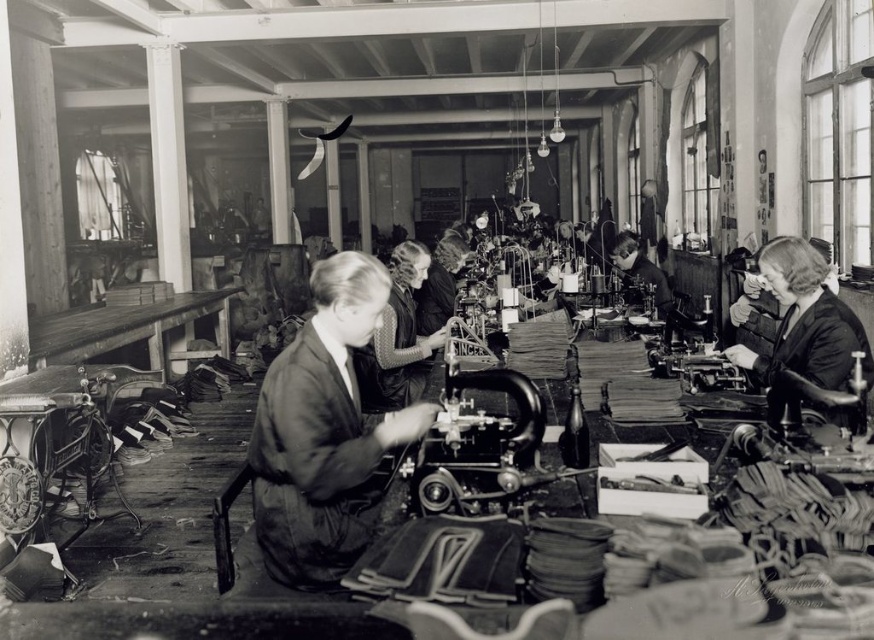
Can you confirm if dark fabric jacket at center is bigger than smooth leather jacket at center?

Incorrect, dark fabric jacket at center is not larger than smooth leather jacket at center.

How far apart are dark fabric jacket at center and smooth leather jacket at center?

dark fabric jacket at center and smooth leather jacket at center are 3.19 meters apart from each other.

Where is `dark fabric jacket at center`? dark fabric jacket at center is located at coordinates [x=324, y=433].

What do you see at coordinates (805, 321) in the screenshot? The height and width of the screenshot is (640, 874). I see `smooth black dress at right` at bounding box center [805, 321].

Is smooth black dress at right further to the viewer compared to matte black dress at center?

No.

Describe the element at coordinates (805, 321) in the screenshot. The image size is (874, 640). I see `smooth black dress at right` at that location.

You are a GUI agent. You are given a task and a screenshot of the screen. Output one action in this format:
    pyautogui.click(x=<x>, y=<y>)
    Task: Click on the smooth black dress at right
    The width and height of the screenshot is (874, 640).
    Given the screenshot: What is the action you would take?
    pyautogui.click(x=805, y=321)

Between point (836, 316) and point (664, 282), which one is positioned in front?

Point (836, 316) is more forward.

Which is more to the right, smooth black dress at right or smooth leather jacket at center?

From the viewer's perspective, smooth leather jacket at center appears more on the right side.

Who is more distant from viewer, (819, 310) or (623, 248)?

The point (623, 248) is behind.

The height and width of the screenshot is (640, 874). In order to click on smooth black dress at right in this screenshot , I will do `click(805, 321)`.